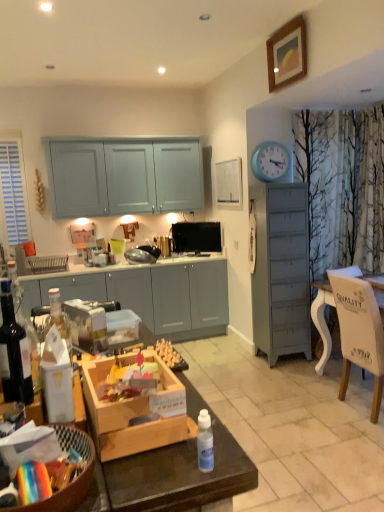
Where is `free spot above blue plastic clock at upper right (from a real-world perspective)`? The height and width of the screenshot is (512, 384). free spot above blue plastic clock at upper right (from a real-world perspective) is located at coordinates (270, 141).